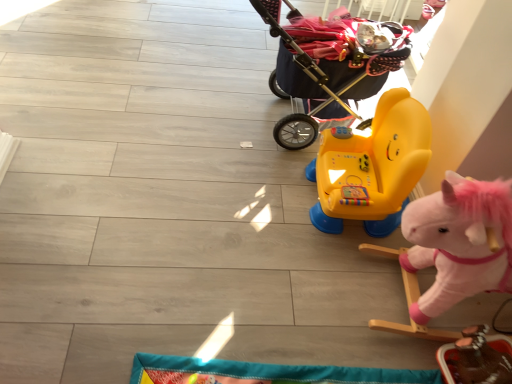
Identify the location of space that is in front of yellow plastic ride-on toy at center, arranged as the 3th toy when ordered from the bottom. The height and width of the screenshot is (384, 512). (317, 268).